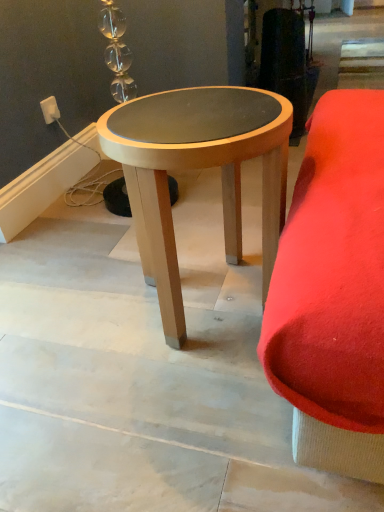
Image resolution: width=384 pixels, height=512 pixels. I want to click on vacant area on the back side of light wood/woodenobject at center, so click(x=192, y=228).